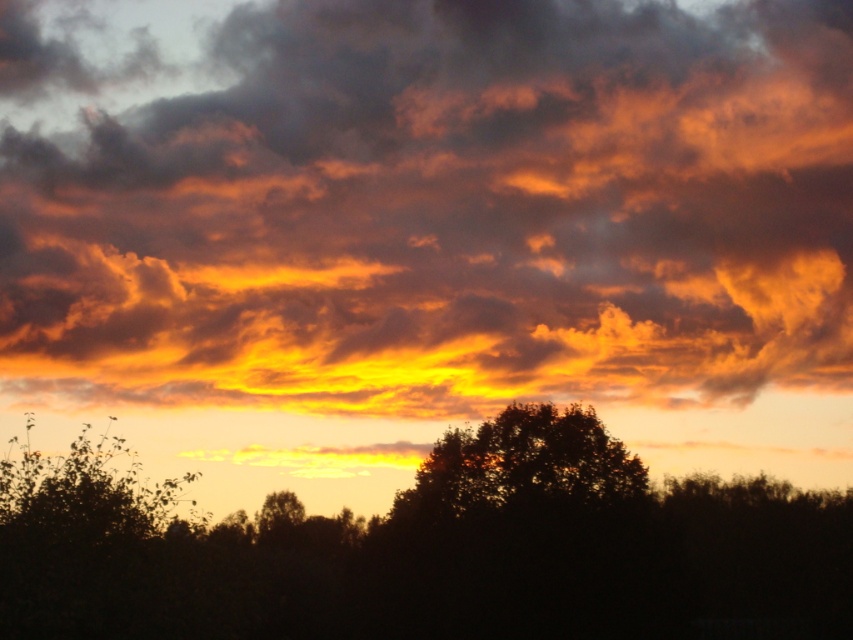
You are an astronomer observing the sunset scene. You notice the orange cotton clouds at upper center and the silhouette tree at center. Which object is positioned higher in the sky?

The orange cotton clouds at upper center are positioned higher in the sky than the silhouette tree at center.

You are standing in the sunset scene and want to place a small flag at both point (277, 88) and point (457, 500). Which point is closer to your current position?

Point (277, 88) is further to the camera than point (457, 500), so the point closer to your current position is point (457, 500).